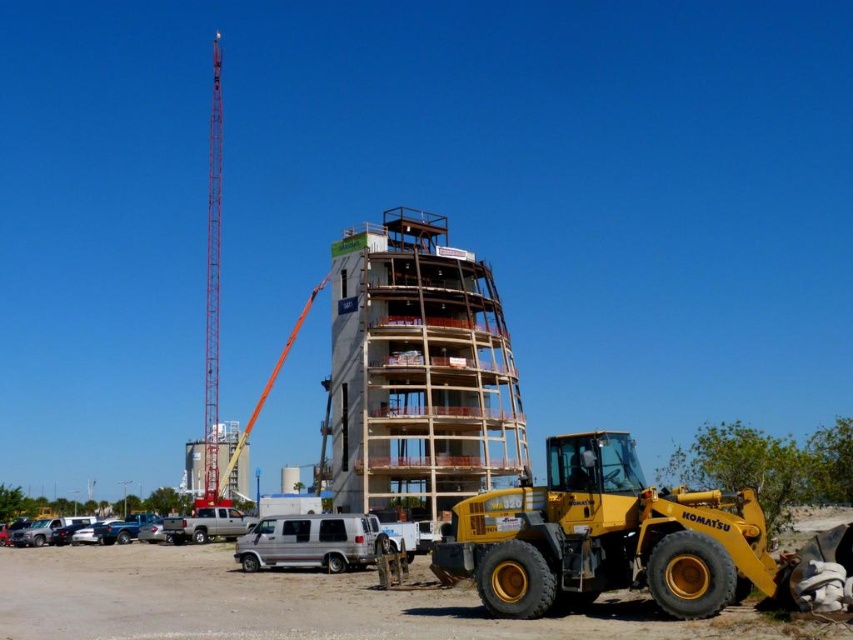
You are a construction worker standing at the base of the wooden scaffolding at center and want to move to the red metallic tower crane at left. Which direction should you walk to reach it?

You should walk to the left to reach the red metallic tower crane at left because the wooden scaffolding at center is closer to the viewer than the red metallic tower crane at left, meaning the crane is positioned to the left side of the scene.

You are standing at the construction site and want to determine which of the two points, point [310,561] or point [204,428], is nearer to you. Based on the scene, which point is closer?

Point [310,561] is closer to the viewer than point [204,428].

You are a delivery driver who needs to park your truck next to the silver metallic van at center and the red metallic tower crane at left. Given that your truck is 8 meters long, can you park it between them without overlapping either vehicle?

The silver metallic van at center is smaller than the red metallic tower crane at left. However, the distance between them is not specified in the provided information, so it is impossible to determine if the truck can park there without overlapping.